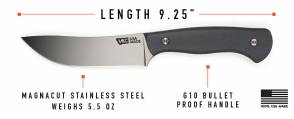
Locate an element on the screen. The height and width of the screenshot is (119, 294). units is located at coordinates (191, 9), (110, 104).